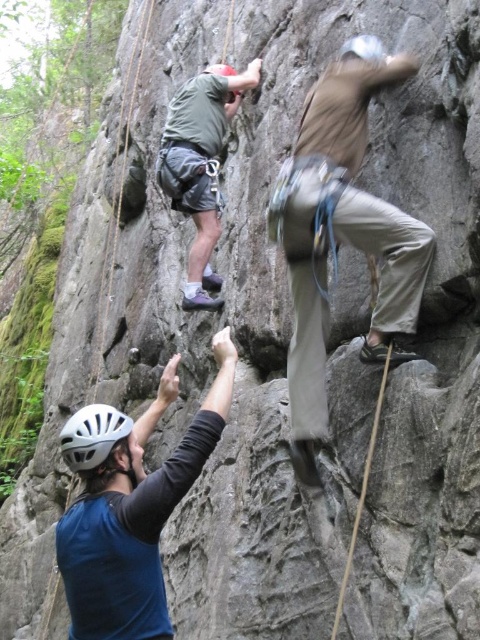
You are a rock climber trying to reach the top of the rock face. You see the green fabric shirt at upper center at point (201, 164). What is the exact coordinate of the green fabric shirt at upper center?

The green fabric shirt at upper center is located at point (201, 164).

You are a safety inspector evaluating the climbing setup. You notice the khaki cotton pants at center and the white matte helmet at lower left. Which climber is positioned higher on the rock face?

The khaki cotton pants at center is located above the white matte helmet at lower left, so the climber wearing the khaki cotton pants at center is positioned higher on the rock face.